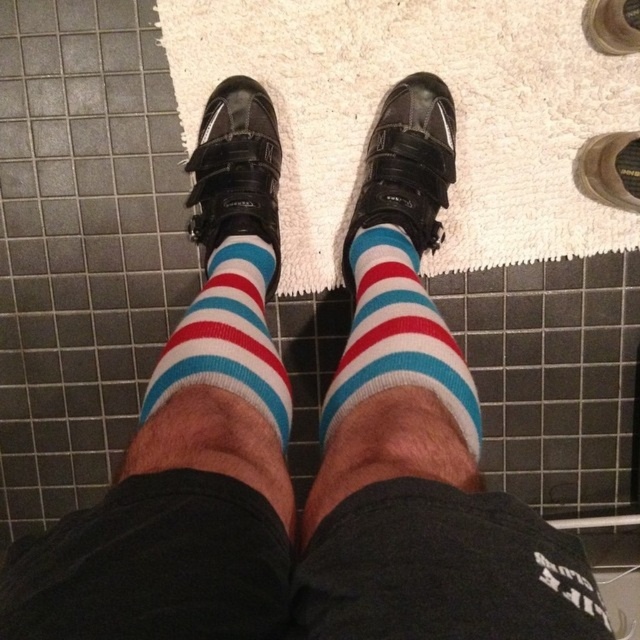
Between point (141, 412) and point (435, 129), which one is positioned behind?

Point (435, 129)

I want to click on striped cotton socks at center, so click(227, 337).

From the picture: Is shiny black shoe at center positioned at the back of matte black shoe at center?

That is False.

In the scene shown: Can you confirm if shiny black shoe at center is bigger than matte black shoe at center?

Yes.

The width and height of the screenshot is (640, 640). Identify the location of shiny black shoe at center. (406, 164).

Find the location of a particular element. black cotton shorts at center is located at coordinates (298, 568).

Which is below, black cotton shorts at center or striped cotton sock at center?

black cotton shorts at center is lower down.

This screenshot has height=640, width=640. What do you see at coordinates (298, 568) in the screenshot?
I see `black cotton shorts at center` at bounding box center [298, 568].

I want to click on black cotton shorts at center, so click(x=298, y=568).